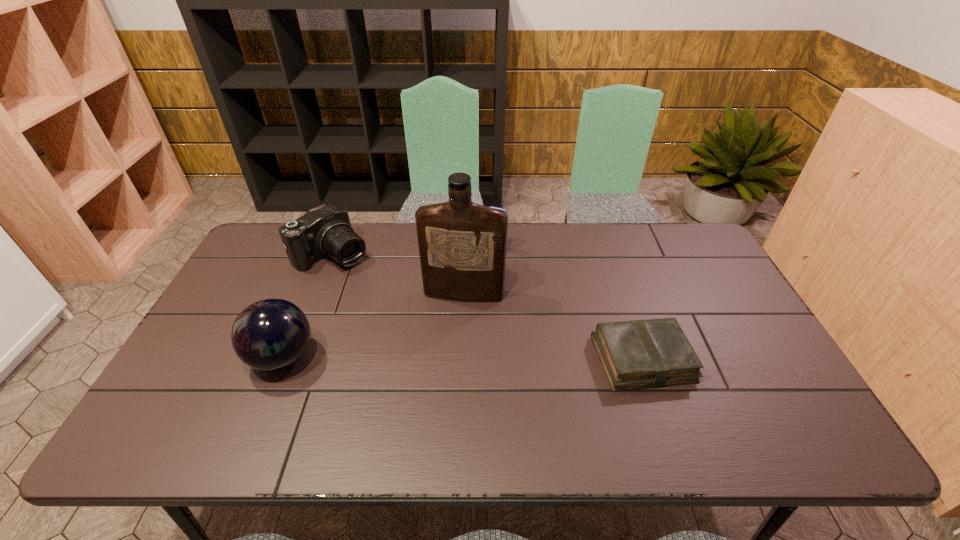
Locate an element on the screen. The width and height of the screenshot is (960, 540). free space on the desktop that is between the bowling ball and the rightmost object and is positioned on the front-facing side of the cellular telephone is located at coordinates (444, 358).

Find the location of `vacant space on the desktop that is between the bowling ball and the book and is positioned on the label side of the liquor`. vacant space on the desktop that is between the bowling ball and the book and is positioned on the label side of the liquor is located at coordinates (451, 358).

Image resolution: width=960 pixels, height=540 pixels. Identify the location of free spot on the desktop that is between the bowling ball and the rightmost object and is positioned on the lens of the camera. (451, 358).